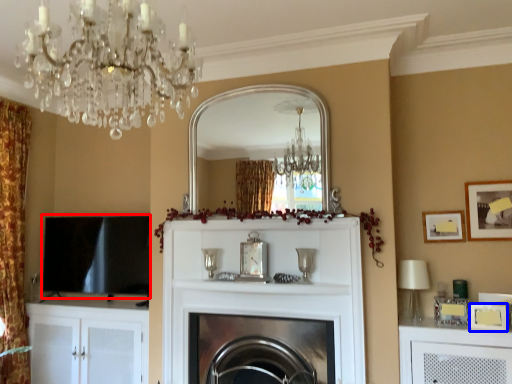
Question: Which object is closer to the camera taking this photo, window screen (highlighted by a red box) or picture frame (highlighted by a blue box)?

Choices:
 (A) window screen
 (B) picture frame

Answer: (B)